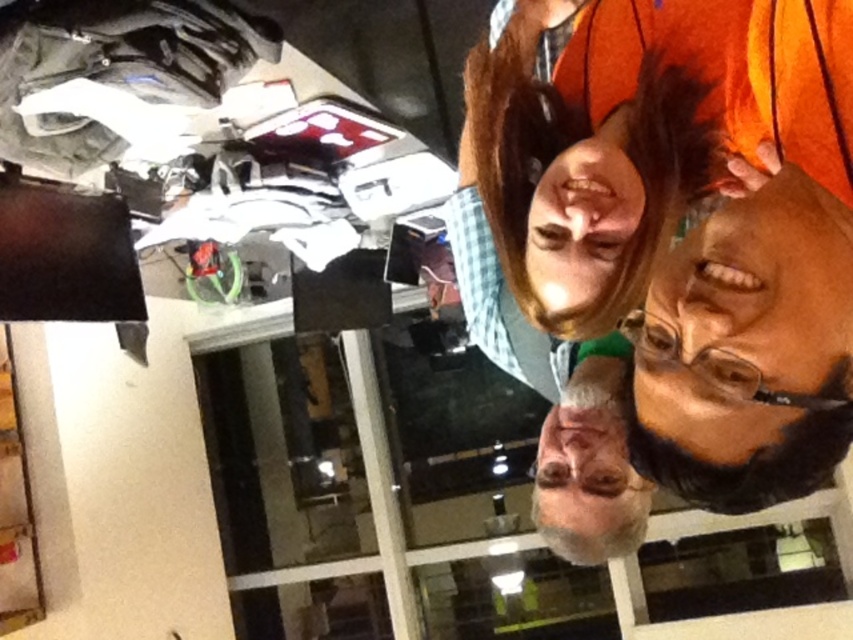
Does matte black glasses at lower right appear over smooth skin face at center?

Actually, matte black glasses at lower right is below smooth skin face at center.

Is point (711, 353) farther from camera compared to point (563, 298)?

No.

The width and height of the screenshot is (853, 640). In order to click on matte black glasses at lower right in this screenshot , I will do `click(749, 323)`.